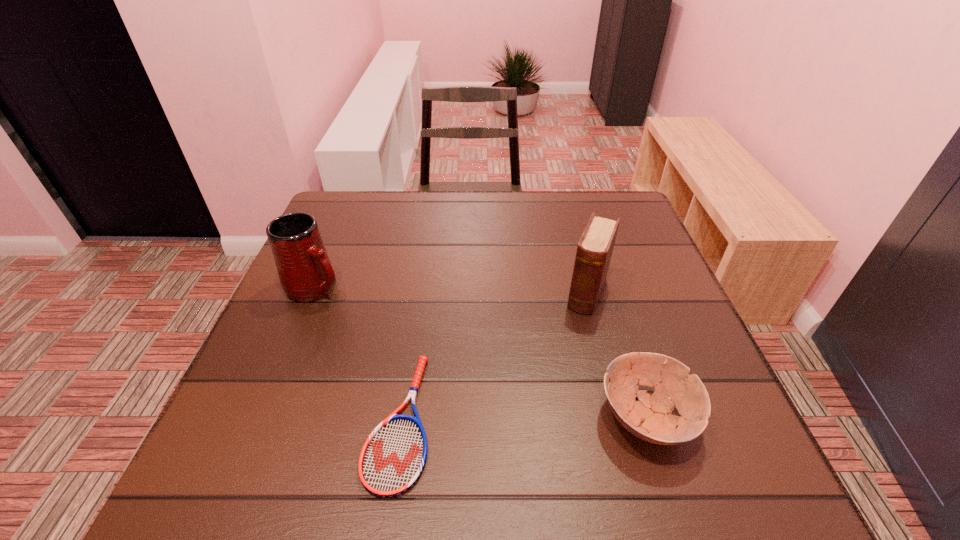
Find the location of a particular element. Image resolution: width=960 pixels, height=540 pixels. the second object from left to right is located at coordinates (392, 459).

Find the location of `the shortest object`. the shortest object is located at coordinates (392, 459).

Identify the location of the third tallest object. Image resolution: width=960 pixels, height=540 pixels. (650, 418).

Where is `diary`? diary is located at coordinates (594, 251).

Where is `mug`? The image size is (960, 540). mug is located at coordinates pyautogui.click(x=306, y=274).

Find the location of a particular element. This screenshot has width=960, height=540. vacant space located on the left of the tennis racket is located at coordinates (245, 421).

Identify the location of vacant space situated 0.080m on the left of the third tallest object. (552, 417).

You are a GUI agent. You are given a task and a screenshot of the screen. Output one action in this format:
    pyautogui.click(x=<x>, y=<y>)
    Task: Click on the free space located on the spine side of the diary
    This screenshot has height=540, width=960.
    Given the screenshot: What is the action you would take?
    pyautogui.click(x=577, y=330)

At what (x,y) coordinates should I click in order to perform the action: click on free space located on the spine side of the diary. Please return your answer as a coordinate pair (x, y). The width and height of the screenshot is (960, 540). Looking at the image, I should click on (556, 383).

Image resolution: width=960 pixels, height=540 pixels. I want to click on vacant space situated 0.270m on the spine side of the diary, so click(544, 413).